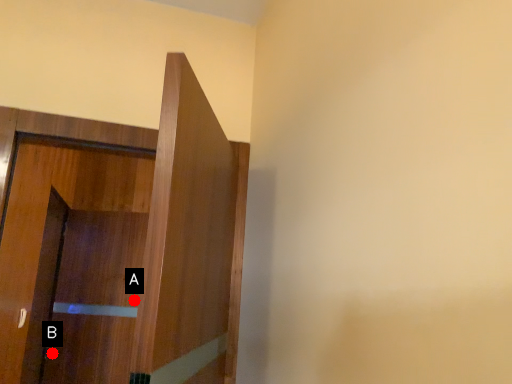
Question: Two points are circled on the image, labeled by A and B beside each circle. Which of the following is the closest to the observer?

Choices:
 (A) A is closer
 (B) B is closer

Answer: (B)